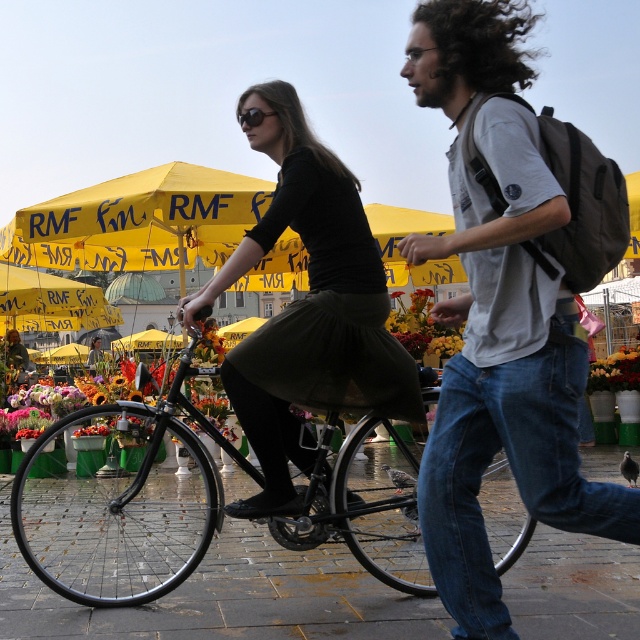
Does denim jeans at center have a greater height compared to black matte sunglasses at upper center?

Yes.

Does point (419, 104) lie in front of point (240, 115)?

Yes.

The width and height of the screenshot is (640, 640). What are the coordinates of `denim jeans at center` in the screenshot? It's located at (499, 320).

Between black matte dress at center and black matte sunglasses at upper center, which one has less height?

With less height is black matte sunglasses at upper center.

Can you confirm if black matte dress at center is thinner than black matte sunglasses at upper center?

No.

You are a GUI agent. You are given a task and a screenshot of the screen. Output one action in this format:
    pyautogui.click(x=<x>, y=<y>)
    Task: Click on the black matte dress at center
    The width and height of the screenshot is (640, 640).
    Given the screenshot: What is the action you would take?
    pyautogui.click(x=307, y=307)

Is shiny black bicycle at center closer to the viewer compared to black matte dress at center?

No.

Can you confirm if shiny black bicycle at center is wider than black matte dress at center?

Correct, the width of shiny black bicycle at center exceeds that of black matte dress at center.

Is point (177, 524) less distant than point (228, 508)?

No.

You are a GUI agent. You are given a task and a screenshot of the screen. Output one action in this format:
    pyautogui.click(x=<x>, y=<y>)
    Task: Click on the shiny black bicycle at center
    
    Given the screenshot: What is the action you would take?
    pyautogui.click(x=120, y=496)